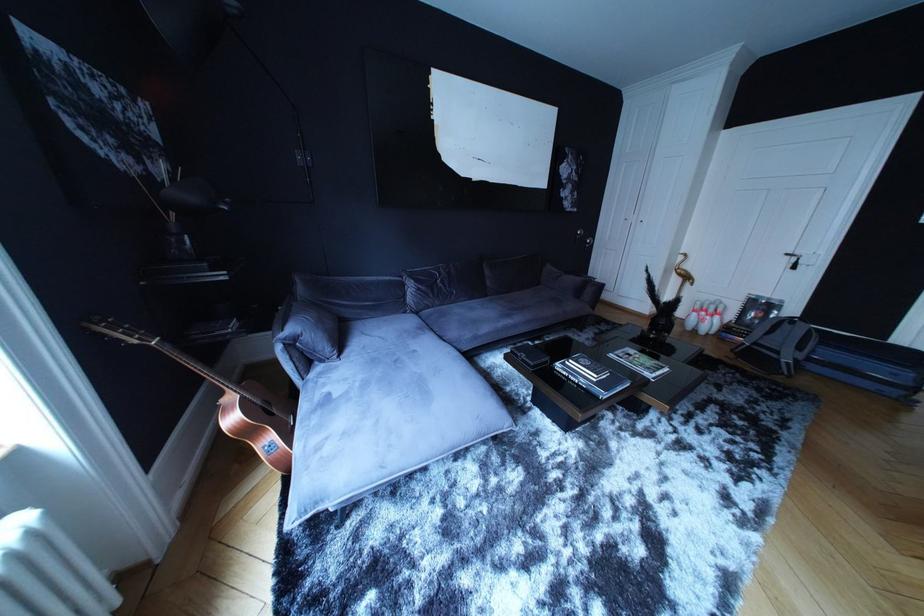
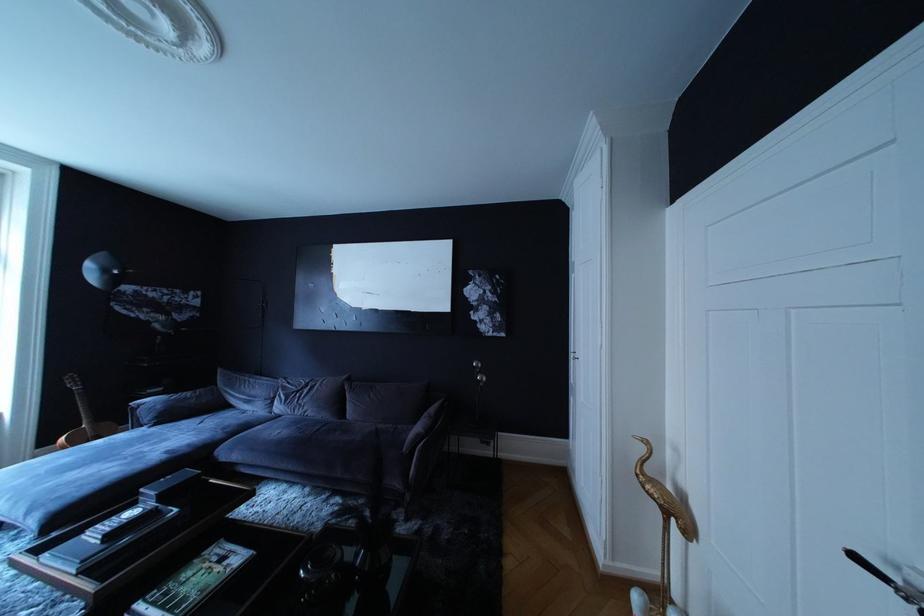
Locate, in the second image, the point that corresponds to point (347, 362) in the first image.

(163, 432)